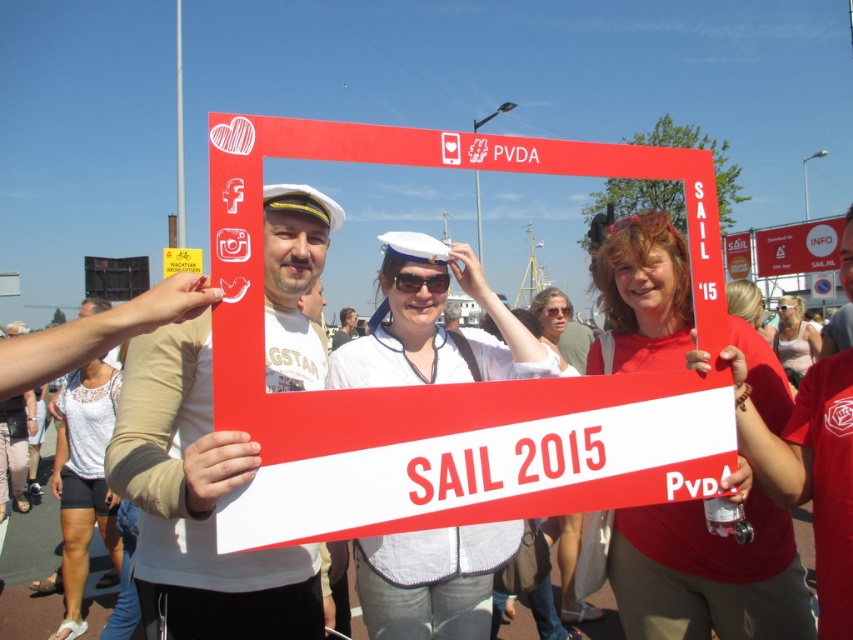
You are a photographer at the event and need to ensure both the matte white blouse at center and transparent plastic goggles at center are visible in your photo. Given their sizes, which object might you need to position closer to the camera to ensure it doesn

The transparent plastic goggles at center are smaller than the matte white blouse at center. To ensure both are visible, you should position the transparent plastic goggles at center closer to the camera since it is smaller and might otherwise appear too tiny in the photo.

You are a photographer at the event and want to capture a shot of the matte white blouse at center and the transparent plastic goggles at center. Which object should you focus on first if you want to include both in your frame without moving the camera?

You should focus on the transparent plastic goggles at center first because the matte white blouse at center is to the right of it, allowing both to be captured in the frame without needing to adjust the camera position.

You are a photographer at the event and want to place a small sticker on the exact center of the image. The sticker is 1 cm in diameter. Given that the matte white blouse at center is located at coordinates point 0.534, 0.933, will the sticker overlap with the blouse?

The exact center of the image is at coordinates point (426, 320). The matte white blouse at center is located at point (795, 340), which is further down and to the right compared to the true center. Therefore, placing a 1 cm diameter sticker at the exact center would not overlap with the matte white blouse at center.